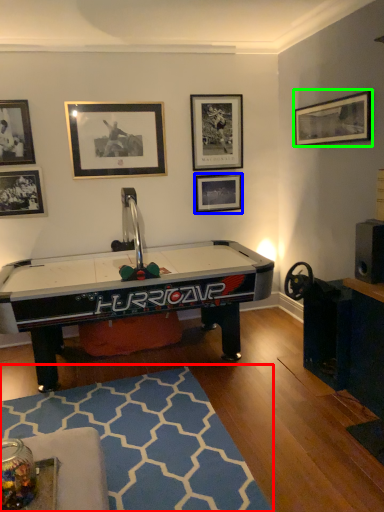
Question: Which is farther away from mat (highlighted by a red box)? picture frame (highlighted by a blue box) or picture frame (highlighted by a green box)?

Choices:
 (A) picture frame
 (B) picture frame

Answer: (B)